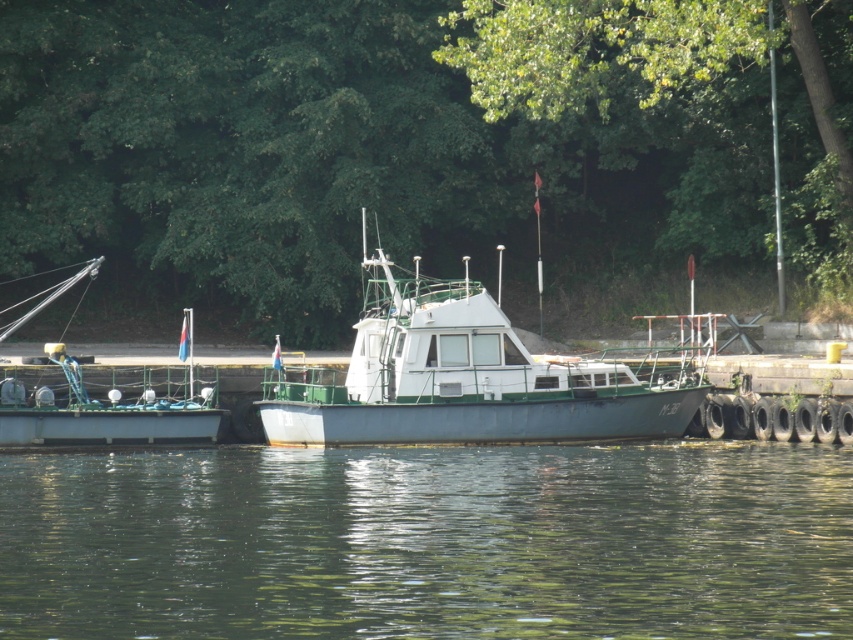
Measure the distance between green leafy tree at upper center and camera.

green leafy tree at upper center and camera are 107.19 feet apart from each other.

Is green leafy tree at upper center to the right of greenish water at lower center from the viewer's perspective?

Indeed, green leafy tree at upper center is positioned on the right side of greenish water at lower center.

What do you see at coordinates (415, 144) in the screenshot?
I see `green leafy tree at upper center` at bounding box center [415, 144].

Where is `green leafy tree at upper center`? green leafy tree at upper center is located at coordinates (415, 144).

Does point (579, 544) come farther from viewer compared to point (511, 348)?

No, (579, 544) is closer to viewer.

At what (x,y) coordinates should I click in order to perform the action: click on greenish water at lower center. Please return your answer as a coordinate pair (x, y). Image resolution: width=853 pixels, height=640 pixels. Looking at the image, I should click on (428, 541).

Does point (270, 413) come farther from viewer compared to point (125, 440)?

Yes, it is.

Can you confirm if white matte boat at center is wider than green matte boat at left?

No, white matte boat at center is not wider than green matte boat at left.

Between point (454, 323) and point (3, 435), which one is positioned behind?

The point (454, 323) is more distant.

You are a GUI agent. You are given a task and a screenshot of the screen. Output one action in this format:
    pyautogui.click(x=<x>, y=<y>)
    Task: Click on the white matte boat at center
    
    Given the screenshot: What is the action you would take?
    pyautogui.click(x=460, y=378)